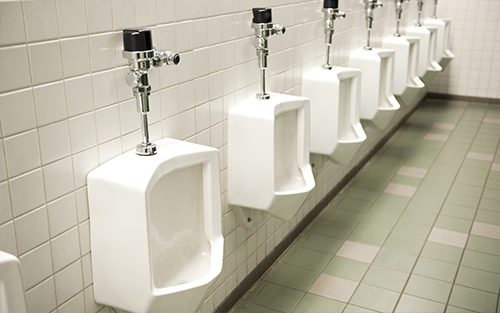
At what (x,y) coordinates should I click in order to perform the action: click on urinals. Please return your answer as a coordinate pair (x, y). The image size is (500, 313). Looking at the image, I should click on (170, 218), (267, 140), (347, 107), (376, 79), (400, 55), (423, 36), (439, 25).